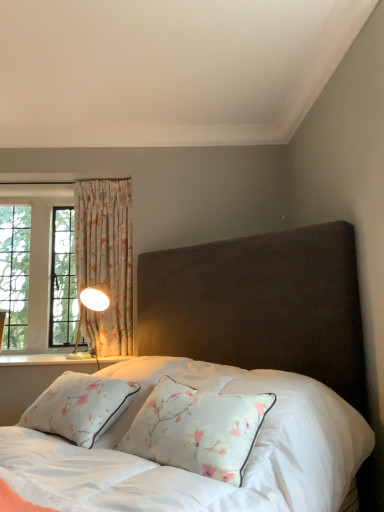
Question: In the image, is white painted wood at lower left positioned in front of or behind floral fabric curtain at left?

Choices:
 (A) front
 (B) behind

Answer: (A)

Question: In terms of size, does white painted wood at lower left appear bigger or smaller than floral fabric curtain at left?

Choices:
 (A) big
 (B) small

Answer: (B)

Question: Considering the real-world distances, which object is farthest from the white painted wood at lower left?

Choices:
 (A) floral fabric curtain at left
 (B) metallic gold table lamp at left
 (C) velvet dark brown bed at center

Answer: (C)

Question: Based on their relative distances, which object is farther from the velvet dark brown bed at center?

Choices:
 (A) white painted wood at lower left
 (B) floral fabric curtain at left
 (C) metallic gold table lamp at left

Answer: (A)